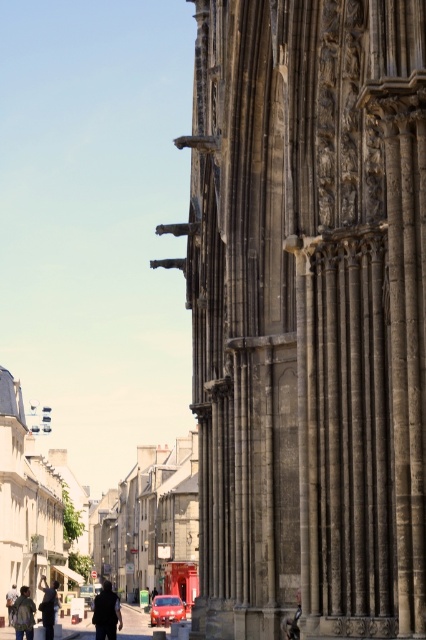
Between denim jacket at lower left and dark gray fabric jacket at lower left, which one has less height?

With less height is dark gray fabric jacket at lower left.

Is point (20, 616) farther from viewer compared to point (13, 612)?

No, (20, 616) is closer to viewer.

Is point (20, 589) farther from camera compared to point (14, 600)?

No.

Locate an element on the screen. Image resolution: width=426 pixels, height=640 pixels. denim jacket at lower left is located at coordinates (23, 614).

Who is more distant from viewer, (210,116) or (184,604)?

The point (184,604) is more distant.

Who is positioned more to the left, dark stone columns at right or shiny red car at center?

Positioned to the left is shiny red car at center.

Is point (293, 225) positioned before point (155, 616)?

Yes, it is in front of point (155, 616).

Where is `dark stone columns at right`? dark stone columns at right is located at coordinates (308, 316).

In the scene shown: Who is higher up, concrete pavement at lower center or denim jacket at lower left?

denim jacket at lower left is higher up.

Between concrete pavement at lower center and denim jacket at lower left, which one has less height?

denim jacket at lower left is shorter.

Identify the location of concrete pavement at lower center. (135, 625).

Where is `concrete pavement at lower center`? This screenshot has height=640, width=426. concrete pavement at lower center is located at coordinates (135, 625).